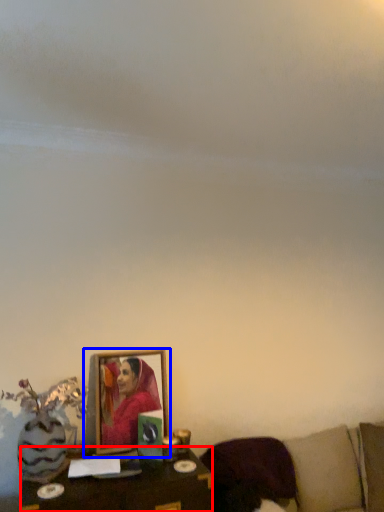
Question: Which object appears farthest to the camera in this image, table (highlighted by a red box) or picture frame (highlighted by a blue box)?

Choices:
 (A) table
 (B) picture frame

Answer: (B)